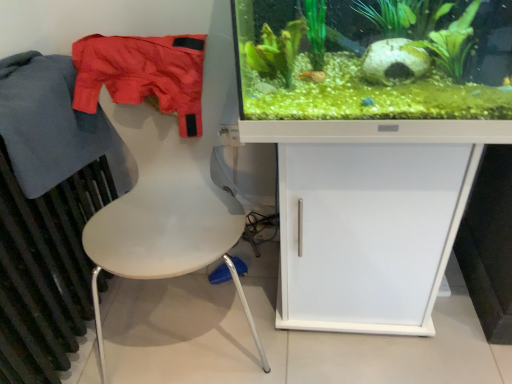
Question: In terms of width, does white matte cabinet at center look wider or thinner when compared to green matte plant at upper center?

Choices:
 (A) thin
 (B) wide

Answer: (B)

Question: Considering the positions of white matte cabinet at center and green matte plant at upper center in the image, is white matte cabinet at center taller or shorter than green matte plant at upper center?

Choices:
 (A) short
 (B) tall

Answer: (B)

Question: Estimate the real-world distances between objects in this image. Which object is closer to the matte nylon shorts at left, placed as the second clothing when sorted from left to right?

Choices:
 (A) dark gray metallic radiator at left
 (B) white matte chair at left
 (C) blue cotton jacket at left, which appears as the 2th clothing when viewed from the right
 (D) white matte cabinet at center
 (E) green matte plant at upper center

Answer: (C)

Question: Based on their relative distances, which object is nearer to the white matte cabinet at center?

Choices:
 (A) green matte plant at upper center
 (B) dark gray metallic radiator at left
 (C) white matte chair at left
 (D) matte nylon shorts at left, placed as the second clothing when sorted from left to right
 (E) blue cotton jacket at left, which appears as the 2th clothing when viewed from the right

Answer: (C)